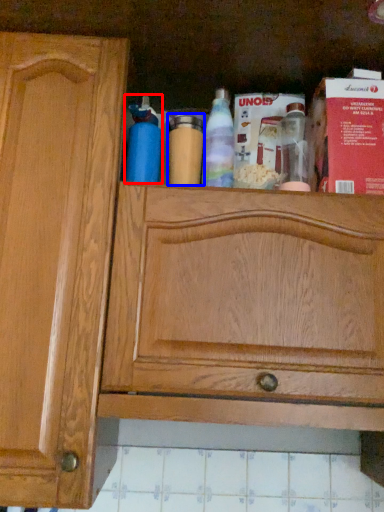
Question: Which object is closer to the camera taking this photo, bottle (highlighted by a red box) or bottle (highlighted by a blue box)?

Choices:
 (A) bottle
 (B) bottle

Answer: (A)